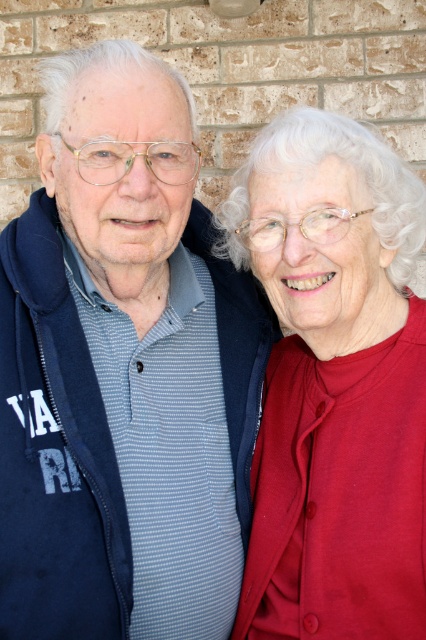
This screenshot has height=640, width=426. What do you see at coordinates (123, 371) in the screenshot?
I see `blue striped shirt at center` at bounding box center [123, 371].

Is blue striped shirt at center above matte red sweater at right?

Indeed, blue striped shirt at center is positioned over matte red sweater at right.

Does point (17, 470) come closer to viewer compared to point (409, 467)?

Yes, point (17, 470) is in front of point (409, 467).

This screenshot has height=640, width=426. Find the location of `blue striped shirt at center`. blue striped shirt at center is located at coordinates (123, 371).